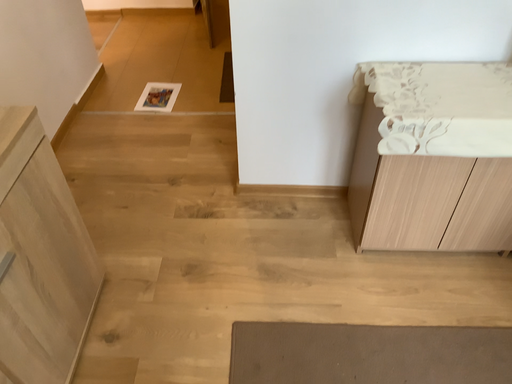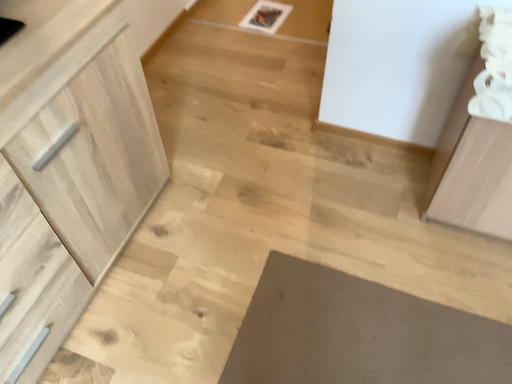
Question: Which way did the camera rotate in the video?

Choices:
 (A) rotated left
 (B) rotated right

Answer: (A)